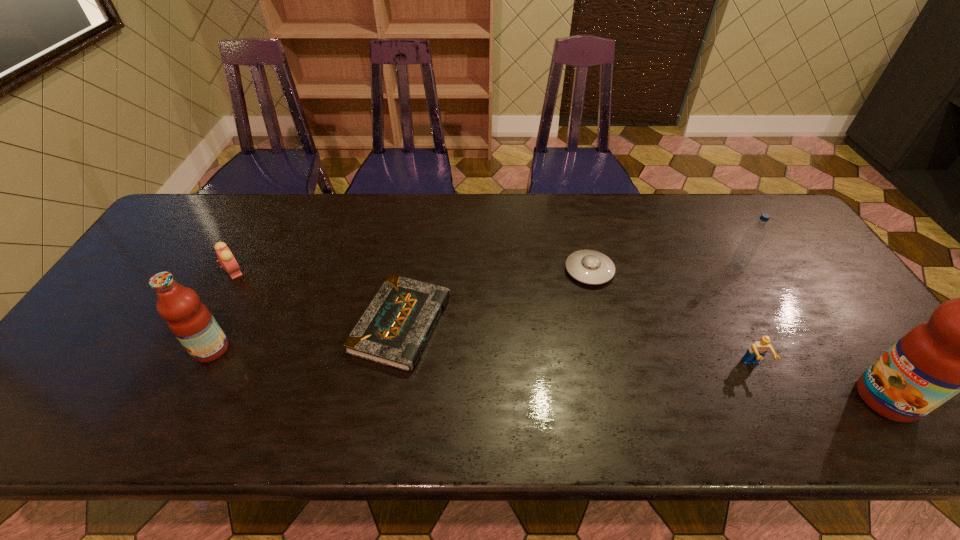
Locate an element on the screen. Image resolution: width=960 pixels, height=540 pixels. Lego is located at coordinates (758, 350).

This screenshot has height=540, width=960. Identify the location of alarm clock. (225, 257).

Locate an element on the screen. vacant space located 0.250m on the front label of the farther fruit juice is located at coordinates (92, 349).

Where is `blank space located on the front label of the farther fruit juice`? The image size is (960, 540). blank space located on the front label of the farther fruit juice is located at coordinates (80, 349).

Find the location of a particular element. The height and width of the screenshot is (540, 960). vacant space situated on the front label of the farther fruit juice is located at coordinates (108, 349).

Where is `free space located on the front label of the rightmost object`? free space located on the front label of the rightmost object is located at coordinates (707, 399).

You are a GUI agent. You are given a task and a screenshot of the screen. Output one action in this format:
    pyautogui.click(x=<x>, y=<y>)
    Task: Click on the vacant space located on the front label of the rightmost object
    The height and width of the screenshot is (540, 960).
    Given the screenshot: What is the action you would take?
    pyautogui.click(x=804, y=399)

At what (x,y) coordinates should I click in order to perform the action: click on vacant space situated 0.340m on the front label of the rightmost object. Please return your answer as a coordinate pair (x, y). The width and height of the screenshot is (960, 540). Looking at the image, I should click on (707, 399).

You are a GUI agent. You are given a task and a screenshot of the screen. Output one action in this format:
    pyautogui.click(x=<x>, y=<y>)
    Task: Click on the vacant space located on the left of the second object from right to left
    Image resolution: width=960 pixels, height=540 pixels.
    Given the screenshot: What is the action you would take?
    pyautogui.click(x=612, y=266)

You are a GUI agent. You are given a task and a screenshot of the screen. Output one action in this format:
    pyautogui.click(x=<x>, y=<y>)
    Task: Click on the vacant space located on the right of the fourth object from left to right
    
    Given the screenshot: What is the action you would take?
    pyautogui.click(x=662, y=271)